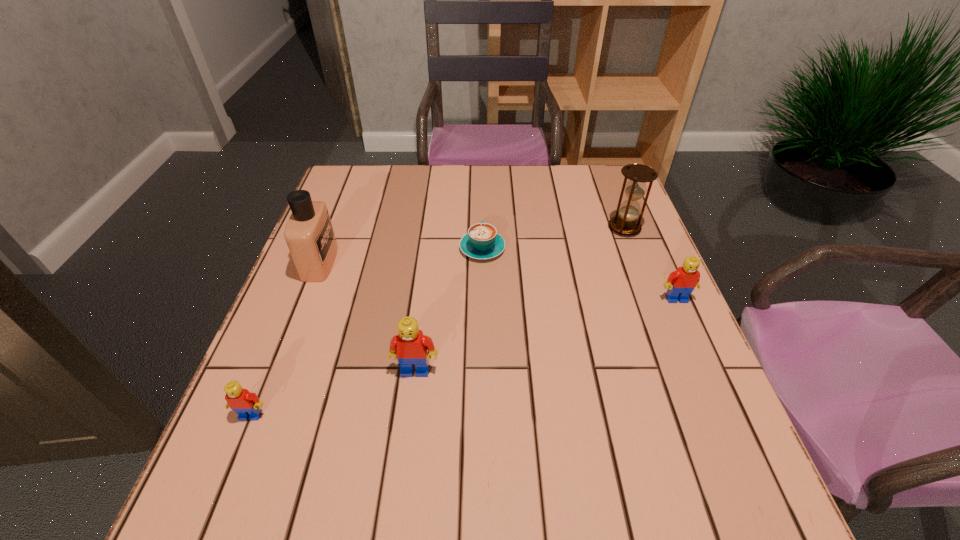
Please point a space for a new Lego to maintain equal intervals. Please provide its 2D coordinates. Your answer should be formatted as a tuple, i.e. [(x, y)], where the tuple contains the x and y coordinates of a point satisfying the conditions above.

[(556, 332)]